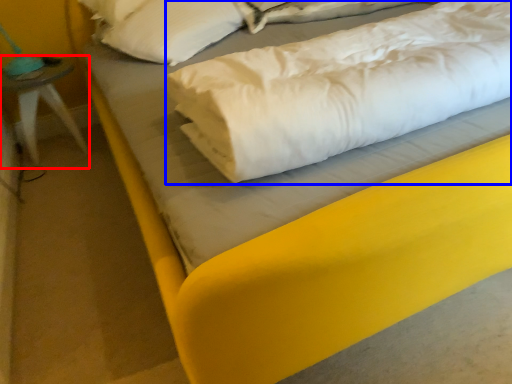
Question: Which object is further to the camera taking this photo, furniture (highlighted by a red box) or linen (highlighted by a blue box)?

Choices:
 (A) furniture
 (B) linen

Answer: (A)